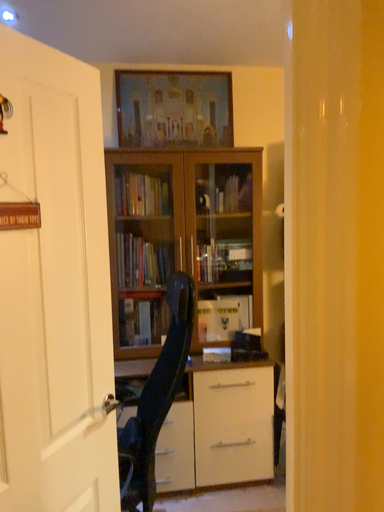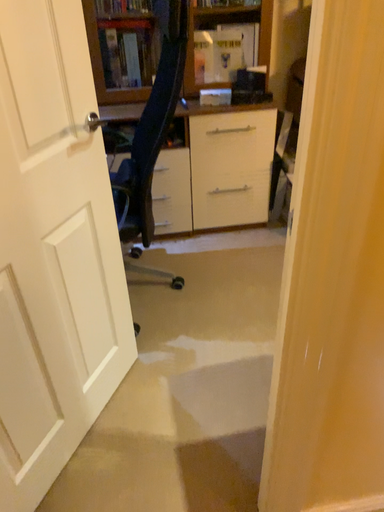
Question: How did the camera likely rotate when shooting the video?

Choices:
 (A) rotated downward
 (B) rotated upward

Answer: (A)